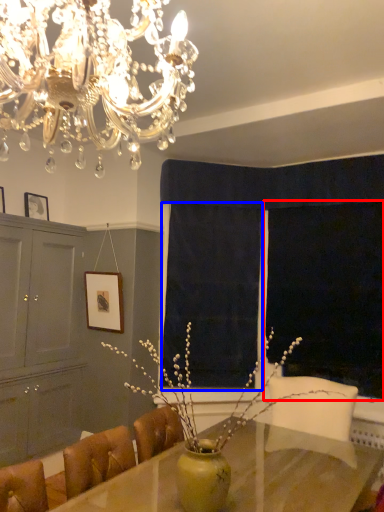
Question: Which object appears closest to the camera in this image, window screen (highlighted by a red box) or curtain (highlighted by a blue box)?

Choices:
 (A) window screen
 (B) curtain

Answer: (A)